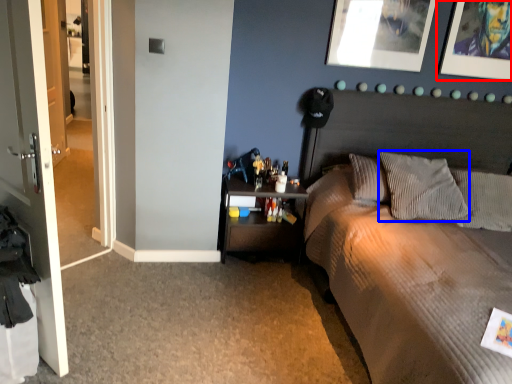
Question: Which of the following is the closest to the observer, picture frame (highlighted by a red box) or pillow (highlighted by a blue box)?

Choices:
 (A) picture frame
 (B) pillow

Answer: (B)